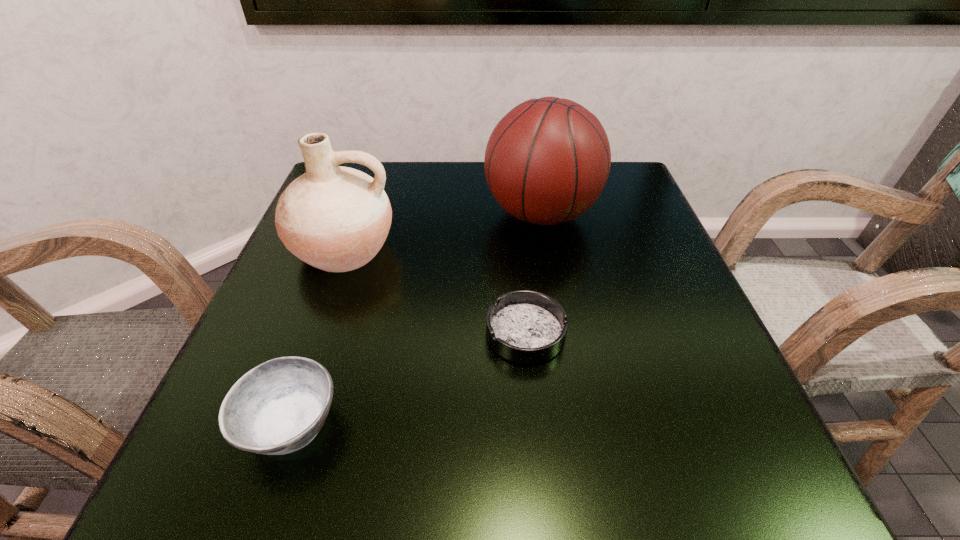
Identify the location of basketball. Image resolution: width=960 pixels, height=540 pixels. (547, 160).

In order to click on pottery in this screenshot , I will do `click(334, 218)`.

Identify the location of the left ashtray. pos(278,407).

Where is `the taller ashtray`? The height and width of the screenshot is (540, 960). the taller ashtray is located at coordinates (278, 407).

At what (x,y) coordinates should I click in order to perform the action: click on the shorter ashtray. Please return your answer as a coordinate pair (x, y). Looking at the image, I should click on (523, 326).

The width and height of the screenshot is (960, 540). What are the coordinates of `the farther ashtray` in the screenshot? It's located at (523, 326).

Identify the location of vacant region located 0.090m on the right of the basketball. (638, 214).

Where is `vacant area situated 0.080m to pour from the handle of the pottery`? vacant area situated 0.080m to pour from the handle of the pottery is located at coordinates (319, 319).

You are a GUI agent. You are given a task and a screenshot of the screen. Output one action in this format:
    pyautogui.click(x=<x>, y=<y>)
    Task: Click on the free space located on the right of the taller ashtray
    
    Given the screenshot: What is the action you would take?
    pyautogui.click(x=522, y=424)

The height and width of the screenshot is (540, 960). I want to click on blank space located on the back of the shorter ashtray, so click(x=516, y=244).